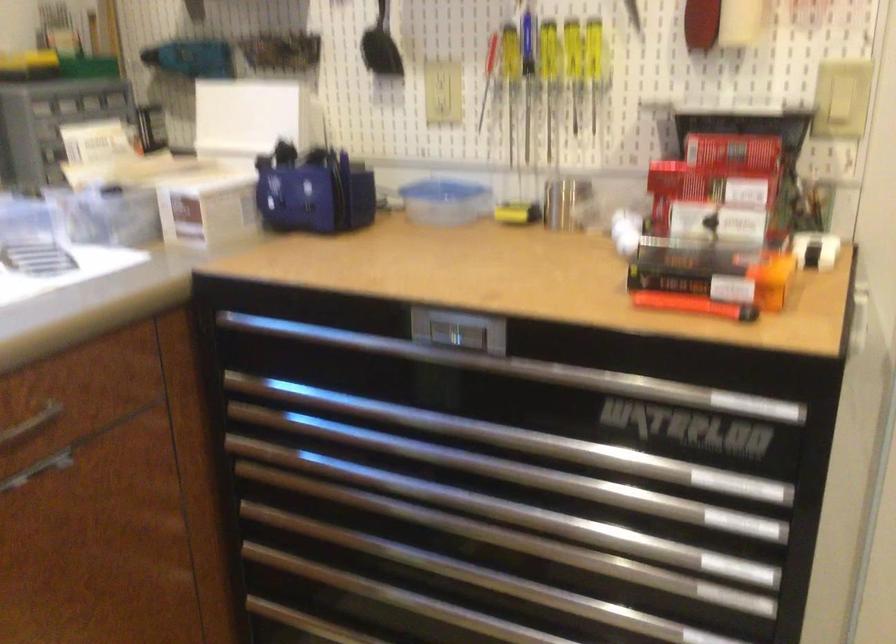
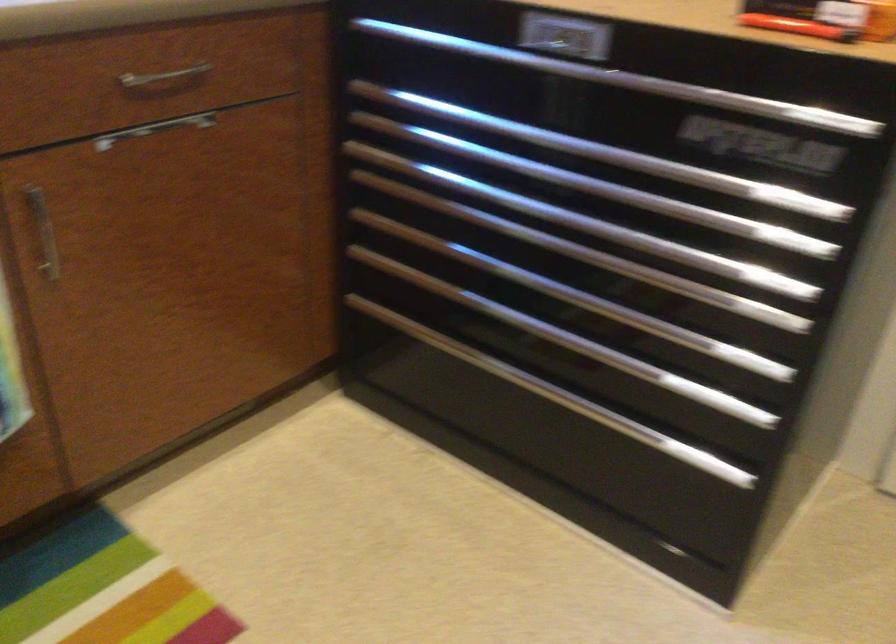
In the second image, find the point that corresponds to point (623, 565) in the first image.

(673, 286)